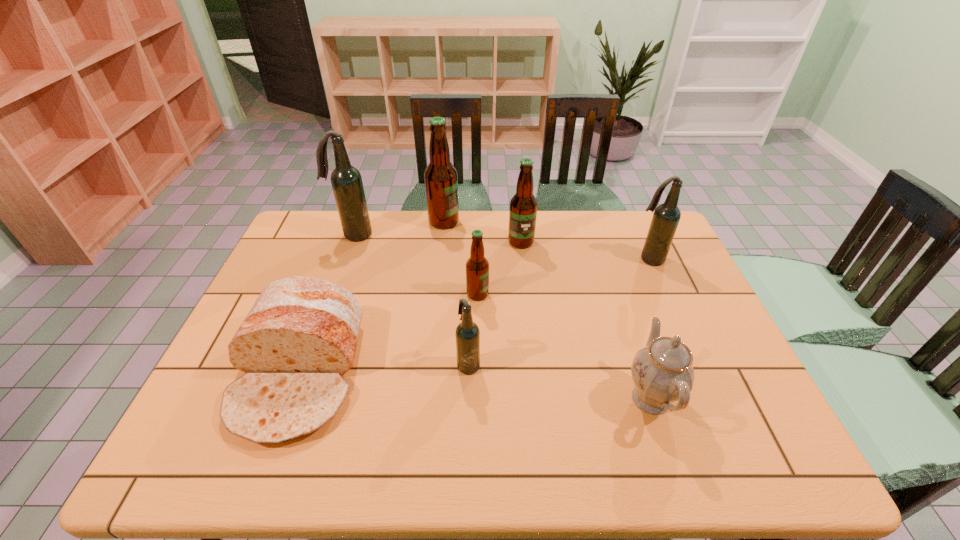
Where is `vacant space at the far edge`? vacant space at the far edge is located at coordinates (501, 219).

The height and width of the screenshot is (540, 960). In the image, there is a desktop. Find the location of `free space at the near edge`. free space at the near edge is located at coordinates (498, 460).

The width and height of the screenshot is (960, 540). In the image, there is a desktop. Find the location of `free region at the left edge`. free region at the left edge is located at coordinates (288, 253).

The image size is (960, 540). In the image, there is a desktop. What are the coordinates of `vacant space at the right edge` in the screenshot? It's located at (680, 264).

At what (x,y) coordinates should I click in order to perform the action: click on vacant area at the far left corner. Please return your answer as a coordinate pair (x, y). The image size is (960, 540). Looking at the image, I should click on (318, 223).

You are a GUI agent. You are given a task and a screenshot of the screen. Output one action in this format:
    pyautogui.click(x=<x>, y=<y>)
    Task: Click on the vacant space at the far right corner of the desktop
    This screenshot has width=960, height=540.
    Given the screenshot: What is the action you would take?
    pyautogui.click(x=628, y=248)

In order to click on vacant space that's between the second smallest brown beer bottle and the bread in this screenshot , I will do `click(410, 308)`.

Locate an element on the screen. This screenshot has width=960, height=540. empty space that is in between the sixth object from left to right and the seventh object from left to right is located at coordinates (586, 320).

In order to click on free space between the fourth farthest object and the smallest brown beer bottle in this screenshot , I will do `click(563, 276)`.

Locate an element on the screen. This screenshot has height=540, width=960. free space between the second object from right to left and the sixth object from left to right is located at coordinates 586,320.